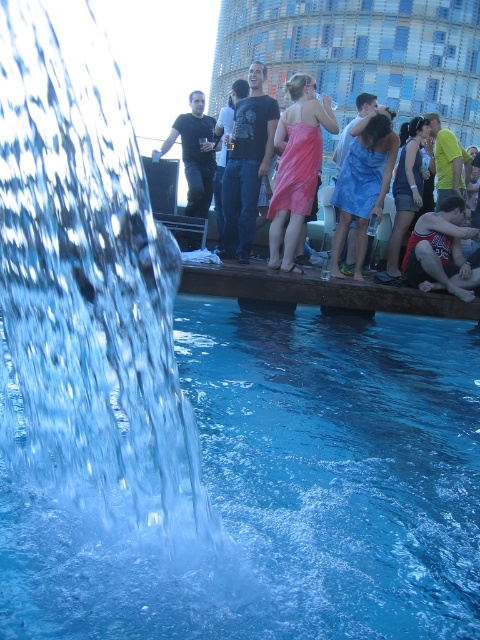
Does clear blue water at center have a lesser width compared to black t-shirt at center?

No.

Is clear blue water at center to the right of black t-shirt at center from the viewer's perspective?

Correct, you'll find clear blue water at center to the right of black t-shirt at center.

You are a GUI agent. You are given a task and a screenshot of the screen. Output one action in this format:
    pyautogui.click(x=<x>, y=<y>)
    Task: Click on the clear blue water at center
    
    Given the screenshot: What is the action you would take?
    pyautogui.click(x=286, y=492)

Locate an element on the screen. This screenshot has width=480, height=640. clear blue water at center is located at coordinates (286, 492).

Does matte black dress at center appear under blue satin dress at center?

Actually, matte black dress at center is above blue satin dress at center.

Between matte black dress at center and blue satin dress at center, which one has more height?

With more height is matte black dress at center.

Between point (307, 96) and point (370, 204), which one is positioned in front?

Positioned in front is point (307, 96).

In order to click on matte black dress at center in this screenshot , I will do `click(249, 189)`.

Is clear blue water at center to the left of blue satin dress at center from the viewer's perspective?

Correct, you'll find clear blue water at center to the left of blue satin dress at center.

Does clear blue water at center appear on the right side of blue satin dress at center?

Incorrect, clear blue water at center is not on the right side of blue satin dress at center.

Where is `clear blue water at center`? clear blue water at center is located at coordinates (286, 492).

Where is `clear blue water at center`? The image size is (480, 640). clear blue water at center is located at coordinates [x=286, y=492].